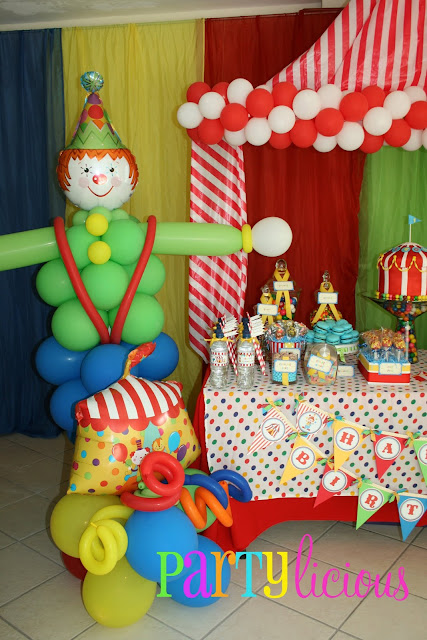
Where is `polka dot table cloth`? The image size is (427, 640). polka dot table cloth is located at coordinates (271, 466).